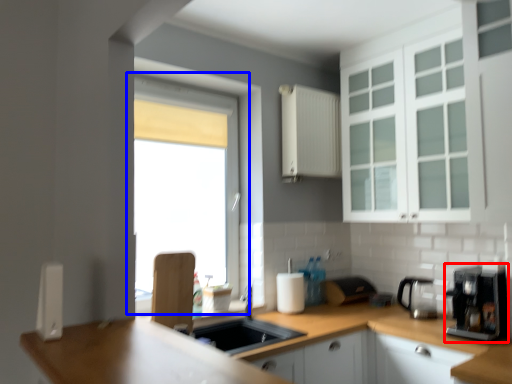
Question: Among these objects, which one is nearest to the camera, coffee machine (highlighted by a red box) or window (highlighted by a blue box)?

Choices:
 (A) coffee machine
 (B) window

Answer: (A)